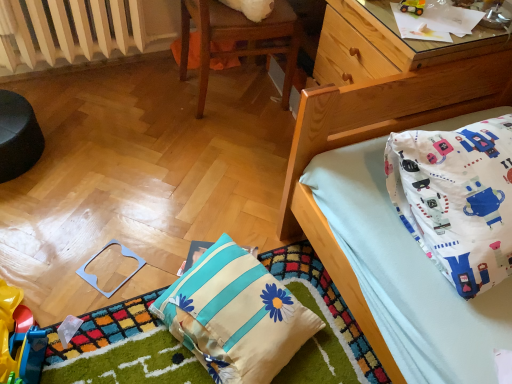
At what (x,y) coordinates should I click in order to perform the action: click on metallic yellow toy car at upper right, arranged as the third toy when ordered from the bottom. Please return your answer as a coordinate pair (x, y). Image resolution: width=512 pixels, height=384 pixels. Looking at the image, I should click on (412, 6).

What do you see at coordinates (412, 6) in the screenshot? I see `metallic yellow toy car at upper right, arranged as the third toy when ordered from the bottom` at bounding box center [412, 6].

Locate an element on the screen. light blue plastic square at lower left, which is counted as the second toy, starting from the top is located at coordinates (96, 276).

The image size is (512, 384). Describe the element at coordinates (69, 31) in the screenshot. I see `white painted metal radiator at upper left` at that location.

I want to click on wooden chair at upper center, so click(x=239, y=38).

This screenshot has height=384, width=512. What do you see at coordinates (19, 339) in the screenshot? I see `rubberized plastic toy at lower left, which ranks as the 3th toy in right-to-left order` at bounding box center [19, 339].

I want to click on white fabric pillow with blue stripes and flower design at lower center, positioned as the 2th pillow in right-to-left order, so click(x=234, y=316).

The width and height of the screenshot is (512, 384). What do you see at coordinates (234, 316) in the screenshot?
I see `white fabric pillow with blue stripes and flower design at lower center, which is counted as the 1th pillow, starting from the left` at bounding box center [234, 316].

Where is `metallic yellow toy car at upper right, placed as the 1th toy when sorted from top to bottom`? This screenshot has width=512, height=384. metallic yellow toy car at upper right, placed as the 1th toy when sorted from top to bottom is located at coordinates [x=412, y=6].

Which object is closer to the camera taking this photo, wooden chair at upper center or wooden bed at upper right?

Positioned in front is wooden bed at upper right.

What's the angular difference between wooden chair at upper center and wooden bed at upper right's facing directions?

The facing directions of wooden chair at upper center and wooden bed at upper right are 180 degrees apart.

From the image's perspective, would you say wooden chair at upper center is shown under wooden bed at upper right?

No, from the image's perspective, wooden chair at upper center is not below wooden bed at upper right.

Is wooden chair at upper center positioned beyond the bounds of wooden bed at upper right?

Yes, wooden chair at upper center is outside of wooden bed at upper right.

Looking at this image, is wooden bed at upper right positioned before white fabric pillow at upper right, the 1th pillow positioned from the right?

No, it is behind white fabric pillow at upper right, the 1th pillow positioned from the right.

From a real-world perspective, is wooden bed at upper right positioned above or below white fabric pillow at upper right, the 2th pillow positioned from the left?

In terms of real-world spatial position, wooden bed at upper right is below white fabric pillow at upper right, the 2th pillow positioned from the left.

Is point (316, 131) closer to camera compared to point (7, 338)?

Yes, point (316, 131) is in front of point (7, 338).

Is wooden bed at upper right positioned far away from rubberized plastic toy at lower left, placed as the 3th toy when sorted from top to bottom?

Yes.

Between wooden bed at upper right and rubberized plastic toy at lower left, placed as the 3th toy when sorted from top to bottom, which one has more height?

With more height is wooden bed at upper right.

From the picture: Is wooden bed at upper right facing away from rubberized plastic toy at lower left, the 1th toy positioned from the left?

No.

Which object is closer to the camera taking this photo, wooden bed at upper right or wooden chair at upper center?

Positioned in front is wooden bed at upper right.

Is wooden bed at upper right positioned with its back to wooden chair at upper center?

No.

Is wooden bed at upper right bigger than wooden chair at upper center?

Correct, wooden bed at upper right is larger in size than wooden chair at upper center.

Would you say white fabric pillow with blue stripes and flower design at lower center, which is counted as the 1th pillow, starting from the left, is part of wooden chair at upper center's contents?

No, wooden chair at upper center does not contain white fabric pillow with blue stripes and flower design at lower center, which is counted as the 1th pillow, starting from the left.

Can you tell me how much wooden chair at upper center and white fabric pillow with blue stripes and flower design at lower center, positioned as the 2th pillow in right-to-left order, differ in facing direction?

The angular difference between wooden chair at upper center and white fabric pillow with blue stripes and flower design at lower center, positioned as the 2th pillow in right-to-left order, is 157 degrees.

Is wooden chair at upper center facing away from white fabric pillow with blue stripes and flower design at lower center, positioned as the 2th pillow in right-to-left order?

No, wooden chair at upper center's orientation is not away from white fabric pillow with blue stripes and flower design at lower center, positioned as the 2th pillow in right-to-left order.

Does wooden chair at upper center appear on the left side of white fabric pillow with blue stripes and flower design at lower center, which is counted as the 1th pillow, starting from the left?

Yes, wooden chair at upper center is to the left of white fabric pillow with blue stripes and flower design at lower center, which is counted as the 1th pillow, starting from the left.

From a real-world perspective, between wooden chair at upper center and white painted metal radiator at upper left, who is vertically lower?

In real-world perspective, white painted metal radiator at upper left is lower.

Is white painted metal radiator at upper left completely or partially inside wooden chair at upper center?

No.

Is white fabric pillow with blue stripes and flower design at lower center, which is counted as the 1th pillow, starting from the left, oriented towards rubberized plastic toy at lower left, which ranks as the 1th toy in bottom-to-top order?

No, white fabric pillow with blue stripes and flower design at lower center, which is counted as the 1th pillow, starting from the left, is not oriented towards rubberized plastic toy at lower left, which ranks as the 1th toy in bottom-to-top order.

Is white fabric pillow with blue stripes and flower design at lower center, positioned as the 2th pillow in right-to-left order, positioned in front of rubberized plastic toy at lower left, placed as the 3th toy when sorted from top to bottom?

No, white fabric pillow with blue stripes and flower design at lower center, positioned as the 2th pillow in right-to-left order, is further to the viewer.

Is point (209, 345) farther from camera compared to point (18, 375)?

Yes, it is.

Identify the location of bed below the wooden chair at upper center (from the image's perspective). This screenshot has width=512, height=384. (378, 121).

The width and height of the screenshot is (512, 384). In order to click on pillow positioned vertically above the wooden bed at upper right (from a real-world perspective) in this screenshot , I will do `click(457, 199)`.

Estimate the real-world distances between objects in this image. Which object is further from white fabric pillow with blue stripes and flower design at lower center, positioned as the 2th pillow in right-to-left order, white painted metal radiator at upper left or light blue plastic square at lower left, which is counted as the second toy, starting from the top?

Based on the image, white painted metal radiator at upper left appears to be further to white fabric pillow with blue stripes and flower design at lower center, positioned as the 2th pillow in right-to-left order.

Looking at the image, which one is located further to wooden bed at upper right, white fabric pillow with blue stripes and flower design at lower center, positioned as the 2th pillow in right-to-left order, or rubberized plastic toy at lower left, the 1th toy positioned from the left?

rubberized plastic toy at lower left, the 1th toy positioned from the left, is further to wooden bed at upper right.

Based on their spatial positions, is light blue plastic square at lower left, the second toy positioned from the left, or white fabric pillow with blue stripes and flower design at lower center, positioned as the 2th pillow in right-to-left order, closer to wooden chair at upper center?

The object closer to wooden chair at upper center is light blue plastic square at lower left, the second toy positioned from the left.

Considering their positions, is white fabric pillow with blue stripes and flower design at lower center, which is counted as the 1th pillow, starting from the left, positioned closer to metallic yellow toy car at upper right, placed as the 1th toy when sorted from top to bottom, than wooden chair at upper center?

wooden chair at upper center.

From the image, which object appears to be nearer to light blue plastic square at lower left, which is counted as the second toy, starting from the top, wooden bed at upper right or metallic yellow toy car at upper right, placed as the 1th toy when sorted from top to bottom?

wooden bed at upper right is positioned closer to the anchor light blue plastic square at lower left, which is counted as the second toy, starting from the top.

Which object lies nearer to the anchor point rubberized plastic toy at lower left, the 1th toy positioned from the left, white painted metal radiator at upper left or white fabric pillow with blue stripes and flower design at lower center, positioned as the 2th pillow in right-to-left order?

Among the two, white fabric pillow with blue stripes and flower design at lower center, positioned as the 2th pillow in right-to-left order, is located nearer to rubberized plastic toy at lower left, the 1th toy positioned from the left.

When comparing their distances from white fabric pillow at upper right, the 2th pillow positioned from the left, does light blue plastic square at lower left, which is counted as the second toy, starting from the top, or white fabric pillow with blue stripes and flower design at lower center, which is counted as the 1th pillow, starting from the left, seem further?

light blue plastic square at lower left, which is counted as the second toy, starting from the top, is positioned further to the anchor white fabric pillow at upper right, the 2th pillow positioned from the left.

When comparing their distances from wooden bed at upper right, does white painted metal radiator at upper left or metallic yellow toy car at upper right, the 1th toy viewed from the right, seem further?

white painted metal radiator at upper left lies further to wooden bed at upper right than the other object.

What are the coordinates of `bed located between white painted metal radiator at upper left and metallic yellow toy car at upper right, the 1th toy viewed from the right, in the left-right direction` in the screenshot? It's located at (378, 121).

Locate an element on the screen. The image size is (512, 384). pillow located between rubberized plastic toy at lower left, which ranks as the 3th toy in right-to-left order, and wooden bed at upper right in the left-right direction is located at coordinates (234, 316).

Image resolution: width=512 pixels, height=384 pixels. What are the coordinates of `pillow between wooden chair at upper center and white fabric pillow with blue stripes and flower design at lower center, positioned as the 2th pillow in right-to-left order, from top to bottom` in the screenshot? It's located at (457, 199).

Locate an element on the screen. The image size is (512, 384). chair between rubberized plastic toy at lower left, which ranks as the 3th toy in right-to-left order, and metallic yellow toy car at upper right, which is the 3th toy from left to right is located at coordinates (239, 38).